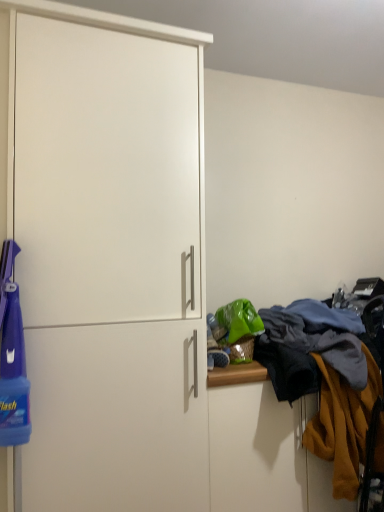
Where is `mustard yellow fabric at right`? The height and width of the screenshot is (512, 384). mustard yellow fabric at right is located at coordinates (343, 424).

Measure the distance between white matte cabinet at left and camera.

They are 4.15 feet apart.

Locate an element on the screen. mustard yellow fabric at right is located at coordinates (343, 424).

Is point (367, 360) positioned after point (335, 375)?

No, (367, 360) is closer to viewer.

Considering the positions of objects textured woolen sweater at right and mustard yellow fabric at right in the image provided, who is more to the left, textured woolen sweater at right or mustard yellow fabric at right?

Positioned to the left is textured woolen sweater at right.

Is textured woolen sweater at right in contact with mustard yellow fabric at right?

Yes, textured woolen sweater at right is touching mustard yellow fabric at right.

What's the angular difference between textured woolen sweater at right and white matte cabinet at left's facing directions?

There is a 1.3-degree angle between the facing directions of textured woolen sweater at right and white matte cabinet at left.

Is textured woolen sweater at right shorter than white matte cabinet at left?

Yes.

Looking at this image, is textured woolen sweater at right spatially inside white matte cabinet at left, or outside of it?

textured woolen sweater at right is not enclosed by white matte cabinet at left.

Is mustard yellow fabric at right taller or shorter than textured woolen sweater at right?

Clearly, mustard yellow fabric at right is taller compared to textured woolen sweater at right.

Is mustard yellow fabric at right surrounding textured woolen sweater at right?

No, textured woolen sweater at right is located outside of mustard yellow fabric at right.

Does mustard yellow fabric at right have a larger size compared to textured woolen sweater at right?

Incorrect, mustard yellow fabric at right is not larger than textured woolen sweater at right.

Is mustard yellow fabric at right next to textured woolen sweater at right?

Yes, mustard yellow fabric at right is beside textured woolen sweater at right.

Considering the relative positions of white matte cabinet at left and textured woolen sweater at right in the image provided, is white matte cabinet at left to the left or to the right of textured woolen sweater at right?

white matte cabinet at left is to the left of textured woolen sweater at right.

Where is `screen door above the textured woolen sweater at right (from a real-world perspective)`? The width and height of the screenshot is (384, 512). screen door above the textured woolen sweater at right (from a real-world perspective) is located at coordinates (105, 175).

Is white matte cabinet at left in contact with textured woolen sweater at right?

white matte cabinet at left and textured woolen sweater at right are clearly separated.

Could you tell me if white matte cabinet at left is facing textured woolen sweater at right?

No, white matte cabinet at left is not turned towards textured woolen sweater at right.

From the image's perspective, which one is positioned higher, mustard yellow fabric at right or white matte cabinet at left?

white matte cabinet at left is shown above in the image.

Based on their positions, is mustard yellow fabric at right located to the left or right of white matte cabinet at left?

mustard yellow fabric at right is to the right of white matte cabinet at left.

From a real-world perspective, does mustard yellow fabric at right stand above white matte cabinet at left?

Actually, mustard yellow fabric at right is physically below white matte cabinet at left in the real world.

Looking at this image, is mustard yellow fabric at right positioned beyond the bounds of white matte cabinet at left?

Indeed, mustard yellow fabric at right is completely outside white matte cabinet at left.

The width and height of the screenshot is (384, 512). In order to click on clothing below the white matte cabinet at left (from the image's perspective) in this screenshot , I will do coord(343,424).

In the scene shown: Do you think white matte cabinet at left is within mustard yellow fabric at right, or outside of it?

white matte cabinet at left is not inside mustard yellow fabric at right, it's outside.

From a real-world perspective, is white matte cabinet at left on top of mustard yellow fabric at right?

Yes.

Where is `clothing on the right side of textured woolen sweater at right`? The image size is (384, 512). clothing on the right side of textured woolen sweater at right is located at coordinates (343, 424).

In order to click on laundry that is under the white matte cabinet at left (from a real-world perspective) in this screenshot , I will do coord(312,419).

Based on their spatial positions, is mustard yellow fabric at right or white matte cabinet at left further from textured woolen sweater at right?

Based on the image, white matte cabinet at left appears to be further to textured woolen sweater at right.

Looking at the image, which one is located further to white matte cabinet at left, mustard yellow fabric at right or textured woolen sweater at right?

mustard yellow fabric at right.

Consider the image. Estimate the real-world distances between objects in this image. Which object is closer to mustard yellow fabric at right, white matte cabinet at left or textured woolen sweater at right?

textured woolen sweater at right.

Looking at the image, which one is located closer to mustard yellow fabric at right, textured woolen sweater at right or white matte cabinet at left?

textured woolen sweater at right lies closer to mustard yellow fabric at right than the other object.

Considering their positions, is textured woolen sweater at right positioned closer to white matte cabinet at left than mustard yellow fabric at right?

textured woolen sweater at right is closer to white matte cabinet at left.

Estimate the real-world distances between objects in this image. Which object is closer to textured woolen sweater at right, white matte cabinet at left or mustard yellow fabric at right?

mustard yellow fabric at right.

Locate an element on the screen. Image resolution: width=384 pixels, height=512 pixels. laundry situated between white matte cabinet at left and mustard yellow fabric at right from left to right is located at coordinates (312, 419).